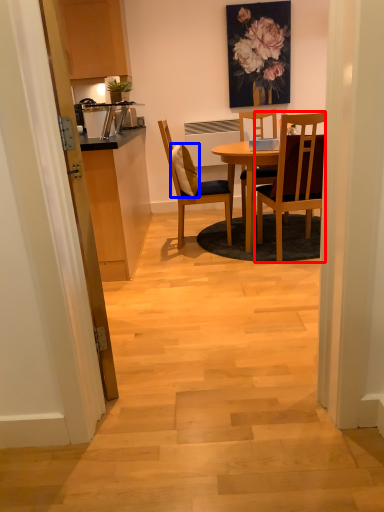
Question: Which object is closer to the camera taking this photo, chair (highlighted by a red box) or pillow (highlighted by a blue box)?

Choices:
 (A) chair
 (B) pillow

Answer: (A)